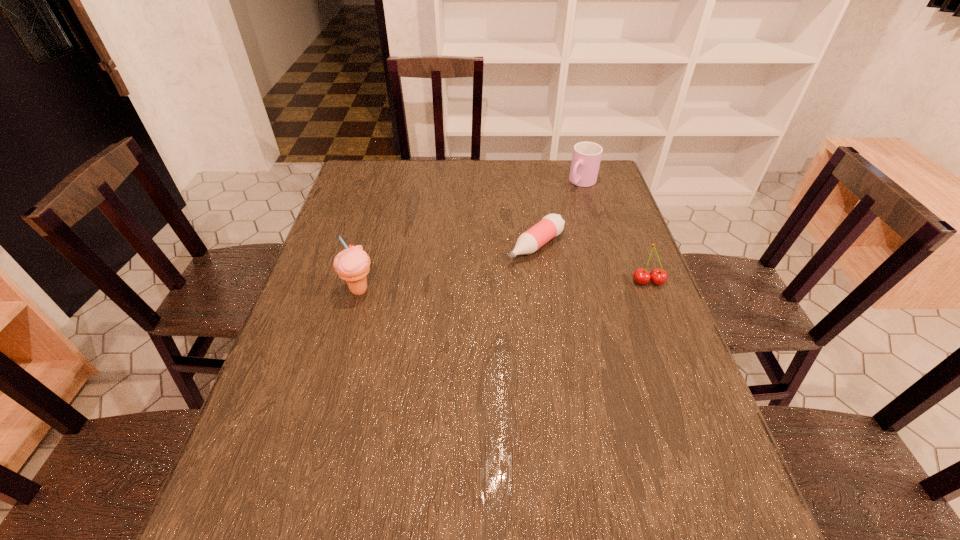
Identify the location of vacant space located 0.080m with the handle on the side of the cup. This screenshot has height=540, width=960. (564, 201).

You are a GUI agent. You are given a task and a screenshot of the screen. Output one action in this format:
    pyautogui.click(x=<x>, y=<y>)
    Task: Click on the free space located with the handle on the side of the cup
    The height and width of the screenshot is (540, 960).
    Given the screenshot: What is the action you would take?
    click(521, 244)

This screenshot has width=960, height=540. Find the location of `vacant space situated with the cap open on the second object from left to right`. vacant space situated with the cap open on the second object from left to right is located at coordinates (495, 278).

Identify the location of free space located 0.240m with the cap open on the second object from left to right. Image resolution: width=960 pixels, height=540 pixels. (456, 307).

This screenshot has width=960, height=540. I want to click on free location located with the cap open on the second object from left to right, so tap(495, 278).

Where is `object located at the far edge`? object located at the far edge is located at coordinates (586, 157).

Identify the location of object at the left edge. The width and height of the screenshot is (960, 540). (352, 264).

Identify the location of cherry that is at the right edge. The height and width of the screenshot is (540, 960). (658, 276).

Identify the location of cup located in the right edge section of the desktop. (586, 157).

Image resolution: width=960 pixels, height=540 pixels. What are the coordinates of `object present at the far right corner` in the screenshot? It's located at (586, 157).